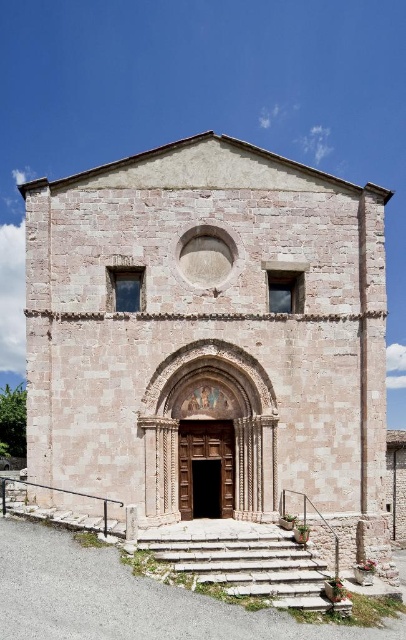
The width and height of the screenshot is (406, 640). Identify the location of light pink stone chapel at center. (211, 342).

Is light pink stone chapel at center to the left of brown wooden door at center from the viewer's perspective?

Incorrect, light pink stone chapel at center is not on the left side of brown wooden door at center.

What do you see at coordinates (211, 342) in the screenshot? I see `light pink stone chapel at center` at bounding box center [211, 342].

The width and height of the screenshot is (406, 640). I want to click on light pink stone chapel at center, so click(x=211, y=342).

Which is more to the right, stone steps at lower center or brown wooden door at center?

stone steps at lower center is more to the right.

Is stone steps at lower center bigger than brown wooden door at center?

Yes.

Measure the distance between stone steps at lower center and camera.

40.84 meters

Locate an element on the screen. The width and height of the screenshot is (406, 640). stone steps at lower center is located at coordinates (244, 563).

From the picture: Which of these two, light pink stone chapel at center or stone steps at lower center, stands shorter?

Standing shorter between the two is stone steps at lower center.

What do you see at coordinates (211, 342) in the screenshot?
I see `light pink stone chapel at center` at bounding box center [211, 342].

Which is in front, point (82, 387) or point (151, 552)?

Point (151, 552) is more forward.

Locate an element on the screen. light pink stone chapel at center is located at coordinates [x=211, y=342].